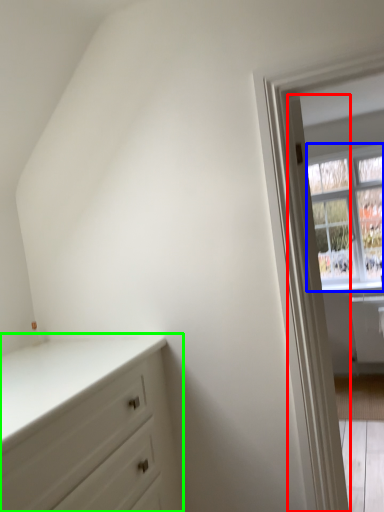
Question: Which is farther away from door (highlighted by a red box)? window (highlighted by a blue box) or chest of drawers (highlighted by a green box)?

Choices:
 (A) window
 (B) chest of drawers

Answer: (A)